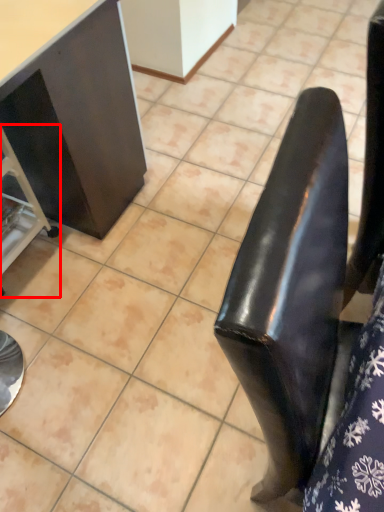
Question: Observing the image, what is the correct spatial positioning of furniture (annotated by the red box) in reference to furniture?

Choices:
 (A) left
 (B) right

Answer: (A)